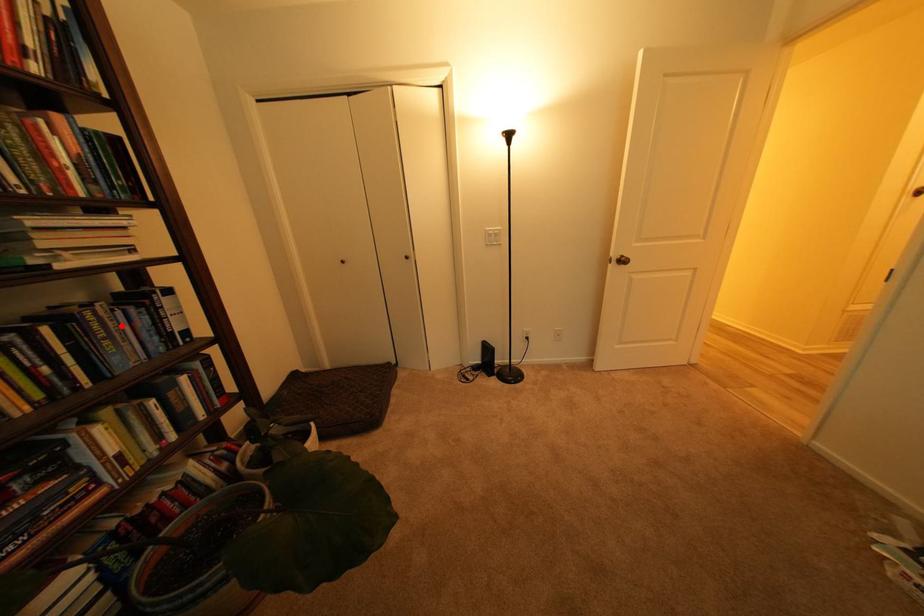
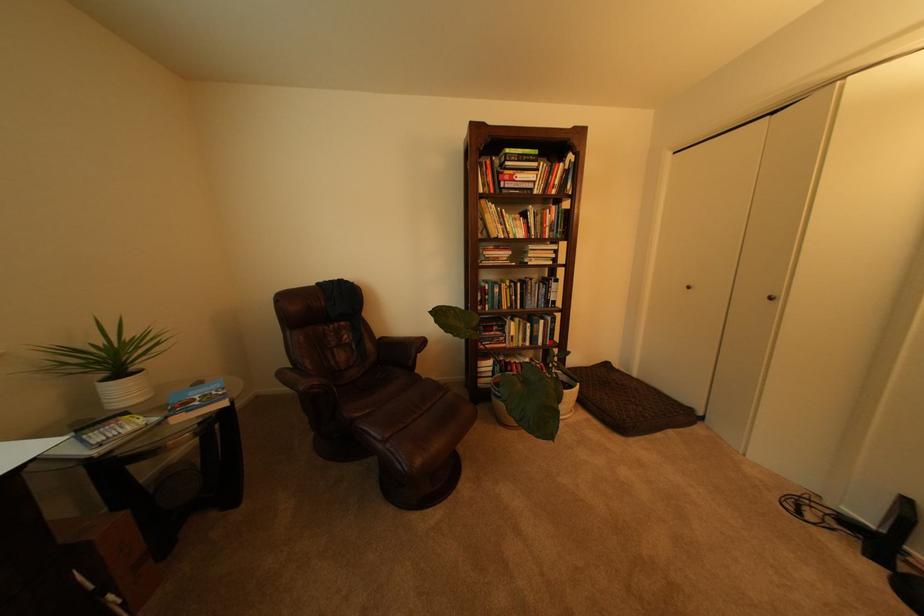
In the second image, find the point that corresponds to the highlighted location in the first image.

(543, 290)